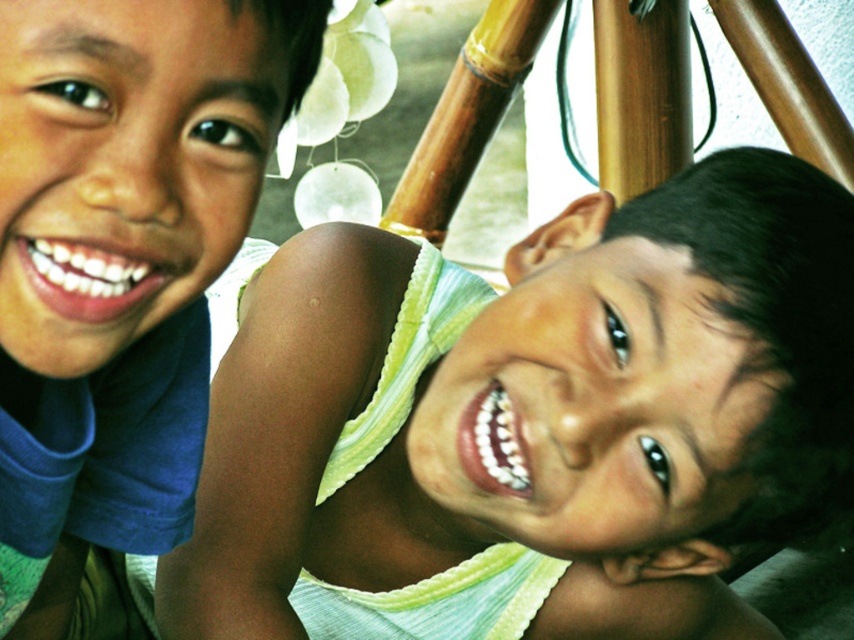
Between matte green shirt at center and matte blue shirt at left, which one appears on the left side from the viewer's perspective?

Positioned to the left is matte blue shirt at left.

Which is above, matte green shirt at center or matte blue shirt at left?

matte blue shirt at left is higher up.

At what (x,y) coordinates should I click in order to perform the action: click on matte green shirt at center. Please return your answer as a coordinate pair (x, y). The height and width of the screenshot is (640, 854). Looking at the image, I should click on (525, 420).